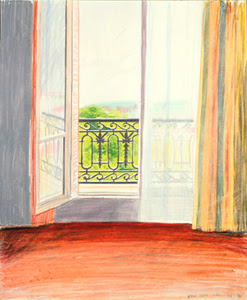
Locate an element on the screen. curtain is located at coordinates (218, 118).